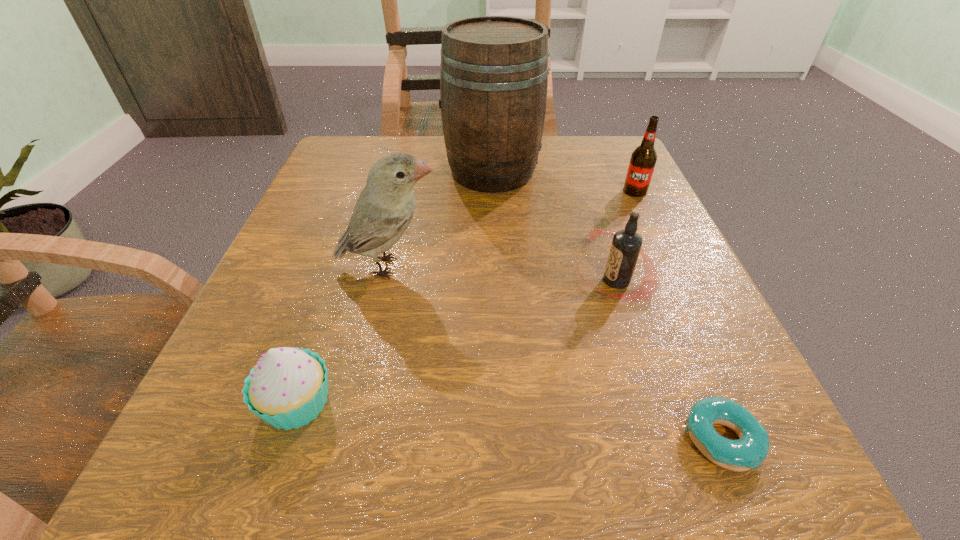
Where is `vacant point that satisfies the following two spatial constraints: 1. on the side of the right root beer near the bung hole; 2. on the left side of the cider`? This screenshot has width=960, height=540. vacant point that satisfies the following two spatial constraints: 1. on the side of the right root beer near the bung hole; 2. on the left side of the cider is located at coordinates (492, 191).

Locate an element on the screen. The image size is (960, 540). vacant area in the image that satisfies the following two spatial constraints: 1. at the face of the doughnut; 2. on the left side of the bird is located at coordinates (349, 440).

Locate an element on the screen. Image resolution: width=960 pixels, height=540 pixels. blank space that satisfies the following two spatial constraints: 1. on the side of the tallest object near the bung hole; 2. on the back side of the shortest object is located at coordinates coord(502,440).